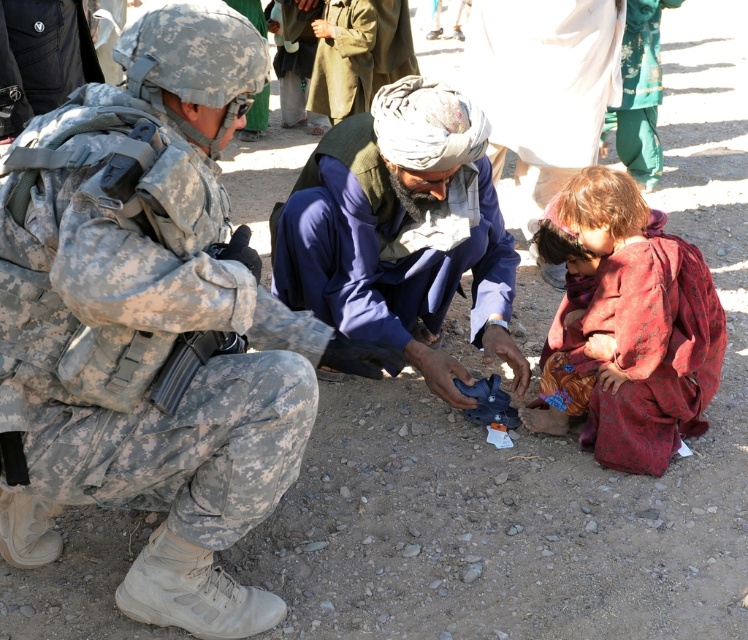
Who is shorter, camouflage fabric uniform at left or blue fabric turban at center?

blue fabric turban at center

Based on the photo, can you confirm if camouflage fabric uniform at left is wider than blue fabric turban at center?

No, camouflage fabric uniform at left is not wider than blue fabric turban at center.

Between point (141, 390) and point (411, 81), which one is positioned behind?

Point (411, 81)

At what (x,y) coordinates should I click in order to perform the action: click on camouflage fabric uniform at left. Please return your answer as a coordinate pair (x, y). Looking at the image, I should click on (153, 324).

The width and height of the screenshot is (748, 640). I want to click on blue fabric turban at center, so click(401, 230).

Where is `blue fabric turban at center`? The image size is (748, 640). blue fabric turban at center is located at coordinates (401, 230).

Who is more forward, [67,468] or [601,173]?

Positioned in front is point [67,468].

The width and height of the screenshot is (748, 640). Describe the element at coordinates (153, 324) in the screenshot. I see `camouflage fabric uniform at left` at that location.

Locate an element on the screen. camouflage fabric uniform at left is located at coordinates (153, 324).